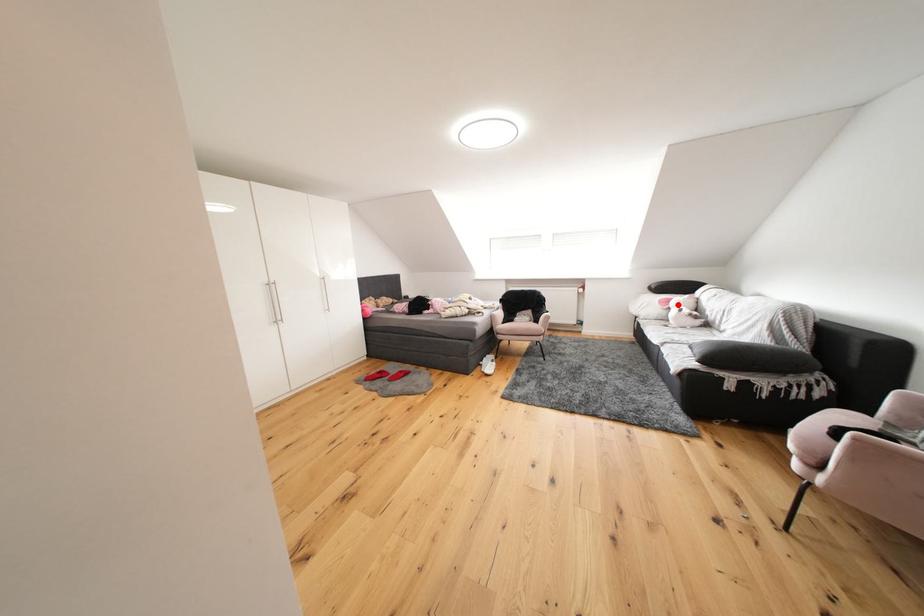
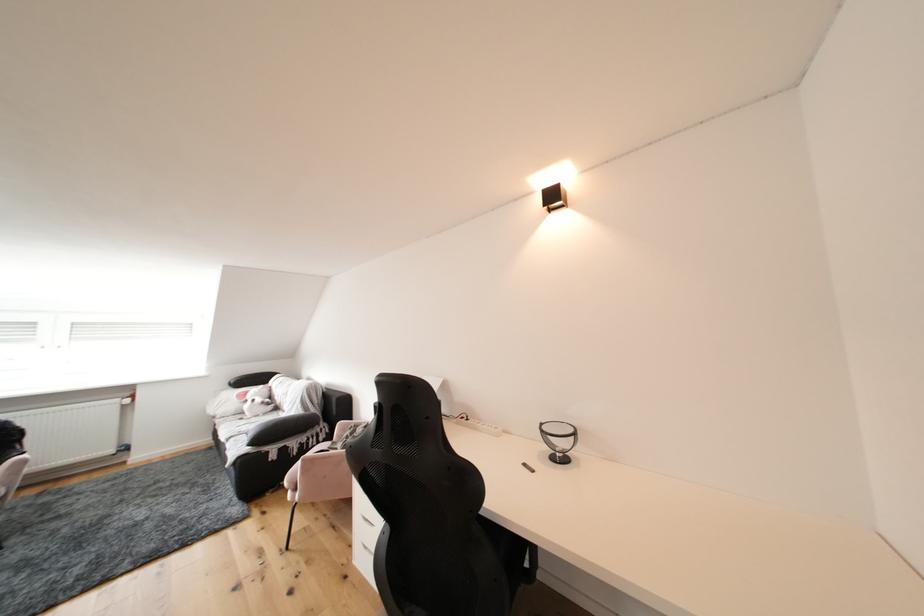
In the second image, find the point that corresponds to the highlighted location in the first image.

(256, 397)